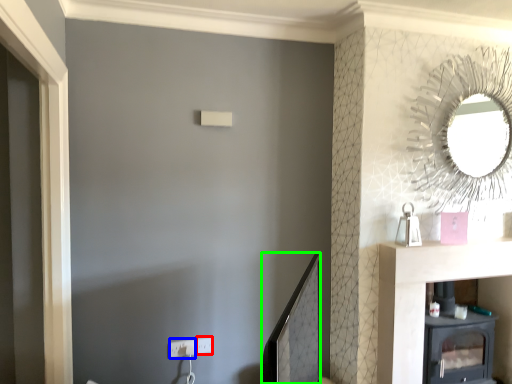
Question: Which object is the closest to the electric outlet (highlighted by a red box)? Choose among these: electric outlet (highlighted by a blue box) or mirror (highlighted by a green box).

Choices:
 (A) electric outlet
 (B) mirror

Answer: (A)